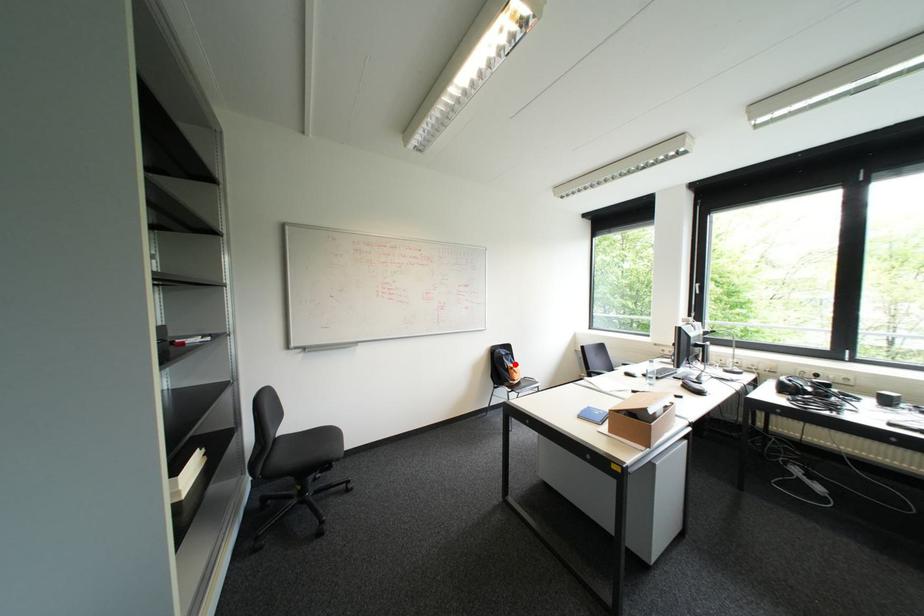
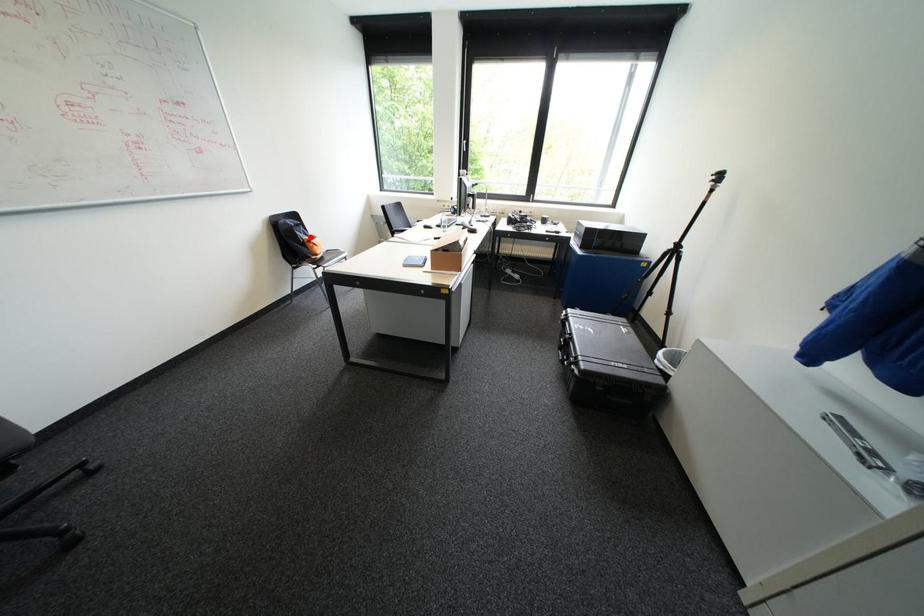
I am providing you with two images of the same scene from different viewpoints. A red point is marked on the first image and another point is marked on the second image. Is the marked point in image1 the same physical position as the marked point in image2?

Yes